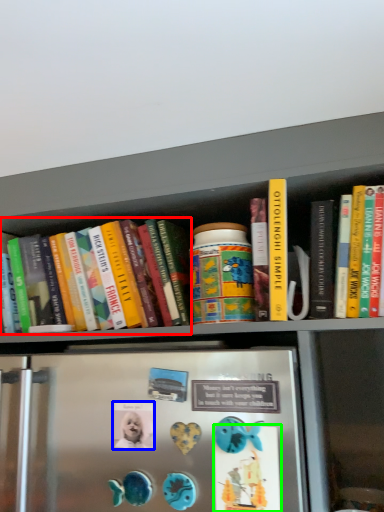
Question: Which is farther away from book (highlighted by a red box)? button (highlighted by a blue box) or button (highlighted by a green box)?

Choices:
 (A) button
 (B) button

Answer: (B)